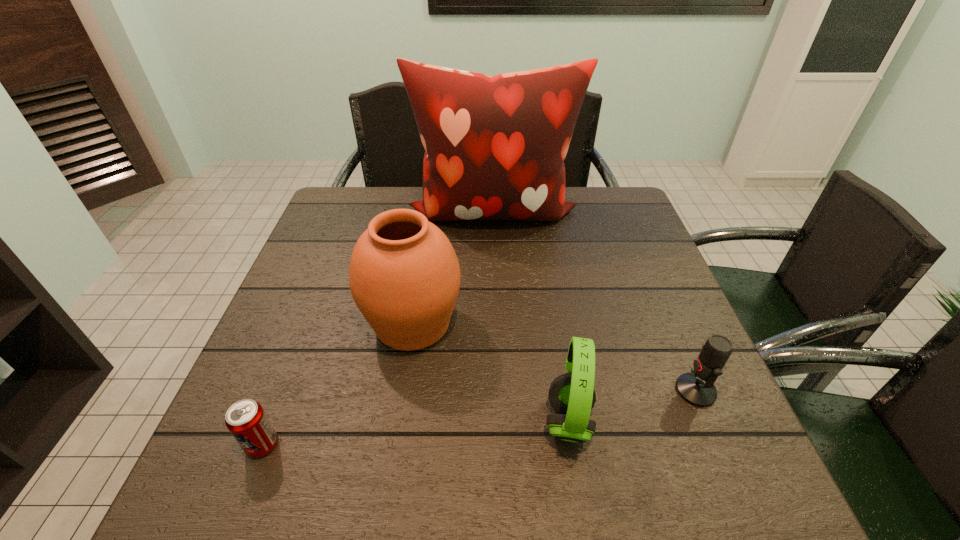
Locate an element on the screen. object at the right edge is located at coordinates (697, 388).

Where is `object that is positioned at the near left corner`? This screenshot has height=540, width=960. object that is positioned at the near left corner is located at coordinates (246, 420).

I want to click on vacant space at the far edge of the desktop, so click(496, 225).

In the image, there is a desktop. Where is `vacant space at the near edge`? vacant space at the near edge is located at coordinates (509, 490).

Find the location of a particular element. The height and width of the screenshot is (540, 960). vacant space at the left edge is located at coordinates (318, 234).

Where is `free space at the right edge of the desktop`? The height and width of the screenshot is (540, 960). free space at the right edge of the desktop is located at coordinates (672, 444).

Where is `vacant space at the far left corner of the desktop`? The image size is (960, 540). vacant space at the far left corner of the desktop is located at coordinates (364, 208).

This screenshot has width=960, height=540. Find the location of `vacant region between the leftmost object and the headset`. vacant region between the leftmost object and the headset is located at coordinates (416, 433).

Image resolution: width=960 pixels, height=540 pixels. I want to click on vacant point located between the headset and the fourth tallest object, so click(632, 406).

Where is `blank region between the rightmost object and the cushion`? blank region between the rightmost object and the cushion is located at coordinates coord(593,301).